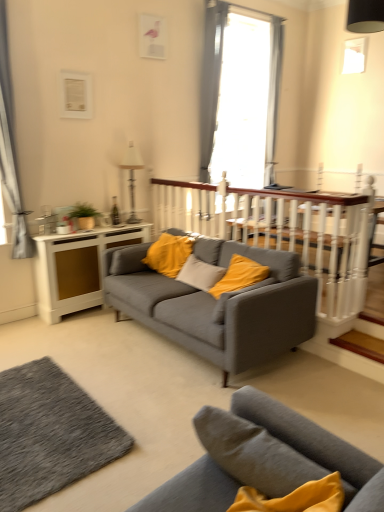
Where is `vacant area that is in front of matte gray couch at center, the second studio couch in the front-to-back sequence`? vacant area that is in front of matte gray couch at center, the second studio couch in the front-to-back sequence is located at coordinates click(x=178, y=404).